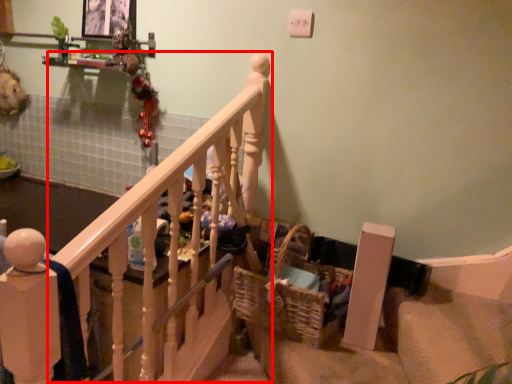
Question: From the image's perspective, what is the correct spatial relationship of rail (annotated by the red box) in relation to basket?

Choices:
 (A) below
 (B) above

Answer: (B)